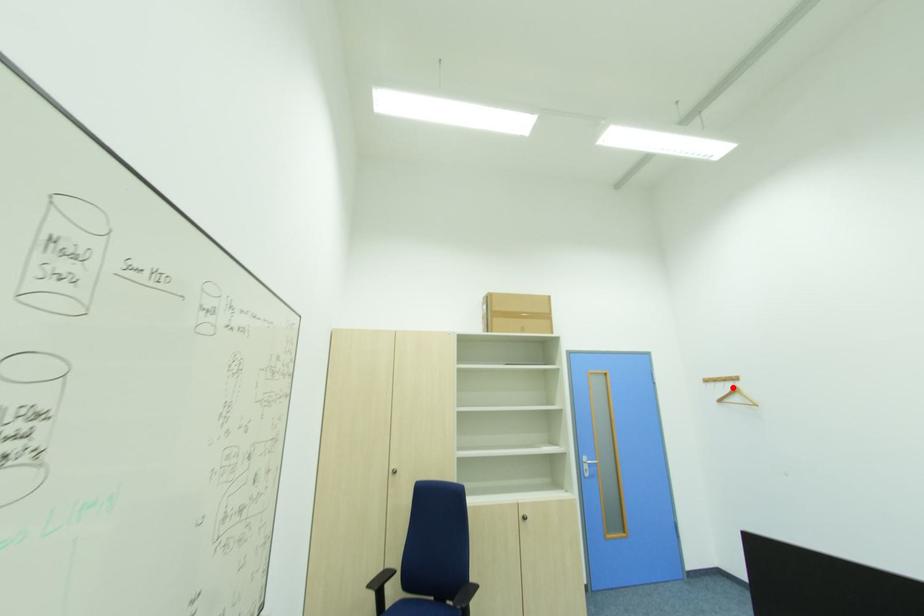
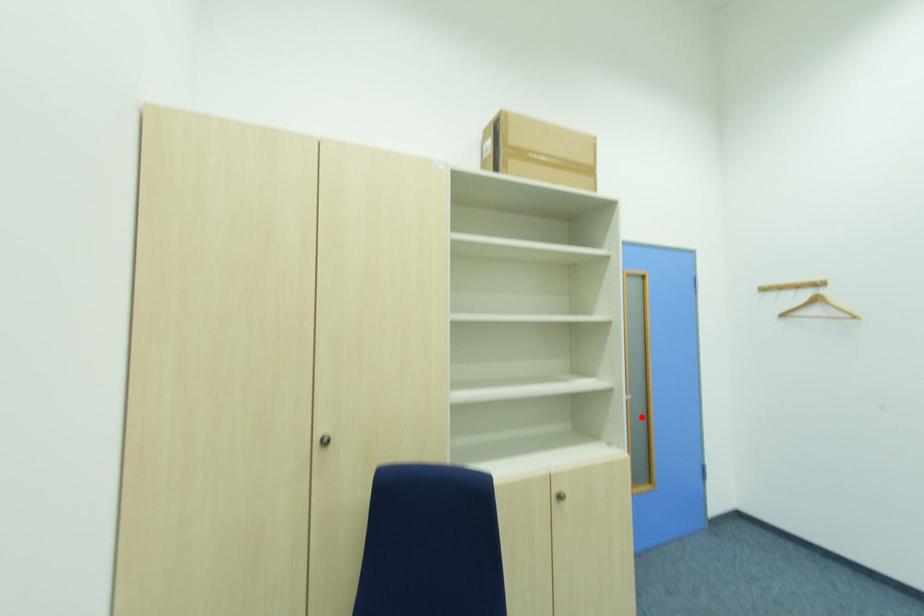
I am providing you with two images of the same scene from different viewpoints. A red point is marked on the first image and another point is marked on the second image. Is the red point in image1 aligned with the point shown in image2?

No